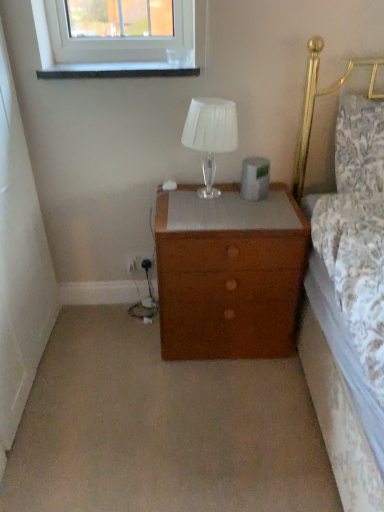
Locate an element on the screen. free space to the left of wooden nightstand at center is located at coordinates (112, 348).